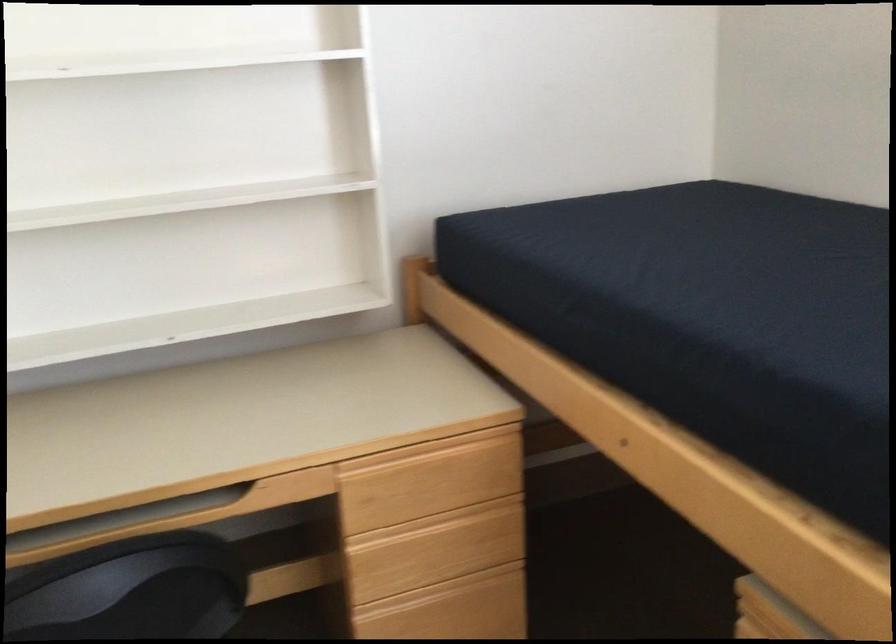
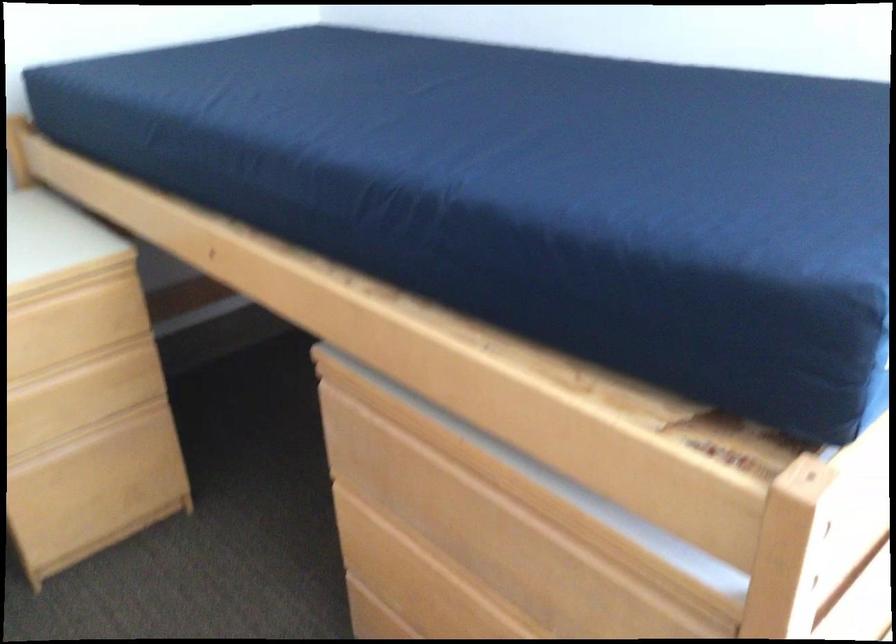
Question: Based on the continuous images, in which direction is the camera rotating? Reply with the corresponding letter.

Choices:
 (A) Left
 (B) Right
 (C) Up
 (D) Down

Answer: (B)